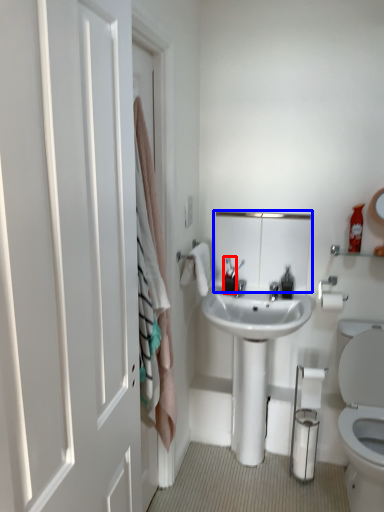
Question: Among these objects, which one is farthest to the camera, toiletry (highlighted by a red box) or medicine cabinet (highlighted by a blue box)?

Choices:
 (A) toiletry
 (B) medicine cabinet

Answer: (A)